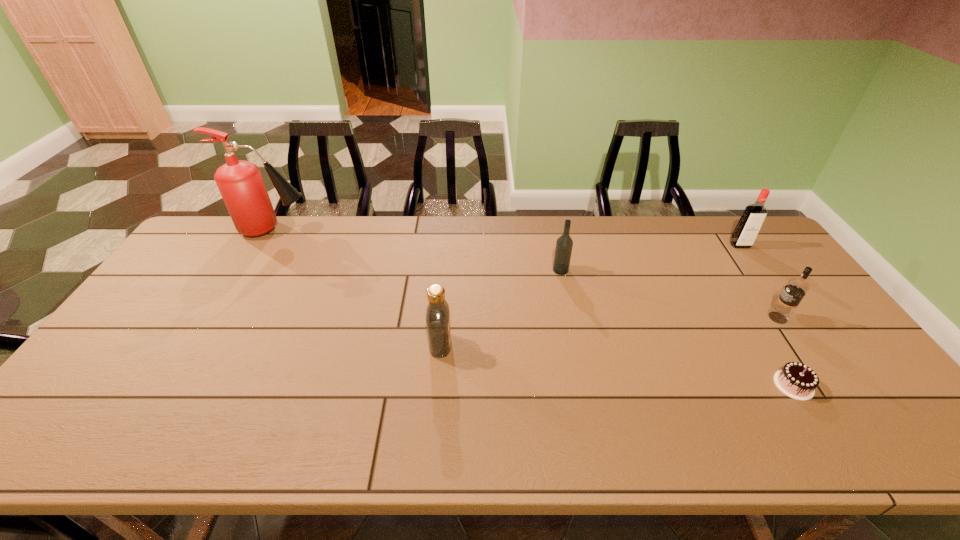
Locate an element on the screen. vacant space located 0.100m with the nozzle aimed from the leftmost object is located at coordinates (340, 229).

Identify the location of free region located on the front and back of the fifth nearest object. The width and height of the screenshot is (960, 540). (x=769, y=286).

At what (x,y) coordinates should I click in order to perform the action: click on vacant point located 0.300m on the front-facing side of the leftmost vodka. Please return your answer as a coordinate pair (x, y). Looking at the image, I should click on tap(564, 345).

Locate an element on the screen. The image size is (960, 540). vacant region located on the back of the third object from left to right is located at coordinates pyautogui.click(x=558, y=255).

Locate an element on the screen. vacant region located 0.390m on the label of the third nearest object is located at coordinates (630, 318).

At what (x,y) coordinates should I click in order to perform the action: click on vacant space located 0.230m on the label of the third nearest object. Please return your answer as a coordinate pair (x, y). The image size is (960, 540). Looking at the image, I should click on (686, 318).

In order to click on vacant space located 0.080m on the label of the third nearest object in this screenshot , I will do `click(739, 318)`.

Find the location of a particular element. This screenshot has width=960, height=540. vacant region located 0.090m on the back of the third object from right to left is located at coordinates (767, 342).

Locate an element on the screen. This screenshot has width=960, height=540. fire extinguisher that is at the far edge is located at coordinates (240, 183).

At what (x,y) coordinates should I click in order to perform the action: click on vodka located at the far edge. Please return your answer as a coordinate pair (x, y). Looking at the image, I should click on (749, 225).